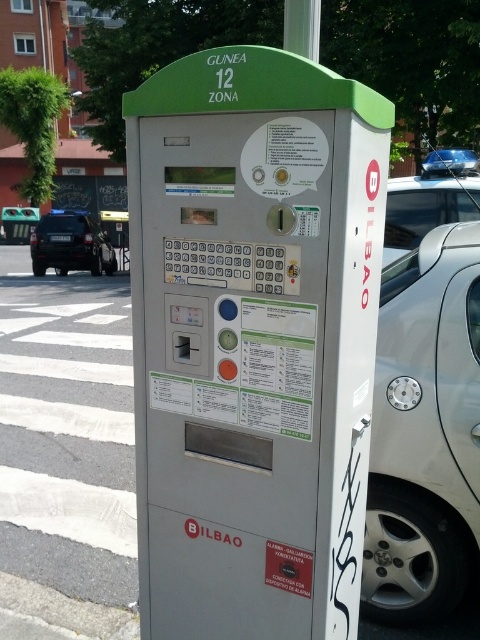
What do you see at coordinates (71, 244) in the screenshot? I see `dark gray metallic suv at left` at bounding box center [71, 244].

Between dark gray metallic suv at left and white plastic pole at upper center, which one appears on the right side from the viewer's perspective?

Positioned to the right is white plastic pole at upper center.

Is point (39, 227) less distant than point (312, 8)?

No, it is not.

Locate an element on the screen. This screenshot has height=640, width=480. dark gray metallic suv at left is located at coordinates (71, 244).

Which is below, metallic gray parking meter at center or dark gray metallic suv at left?

metallic gray parking meter at center is lower down.

Does metallic gray parking meter at center appear over dark gray metallic suv at left?

Incorrect, metallic gray parking meter at center is not positioned above dark gray metallic suv at left.

Is point (170, 332) in front of point (80, 216)?

Yes, it is.

Where is `metallic gray parking meter at center`? Image resolution: width=480 pixels, height=640 pixels. metallic gray parking meter at center is located at coordinates (252, 340).

Is silver metallic car at right wider than metallic silver car at right?

Yes.

Consider the image. How far apart are silver metallic car at right and metallic silver car at right?

They are 5.95 meters apart.

Is point (459, 282) farther from viewer compared to point (441, 152)?

That is False.

Find the location of a particular element. silver metallic car at right is located at coordinates (x=425, y=404).